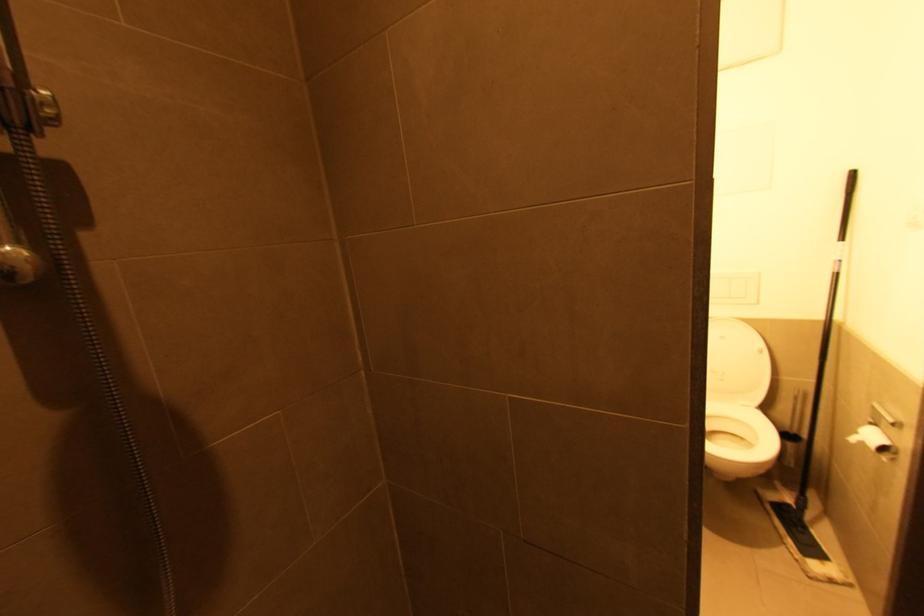
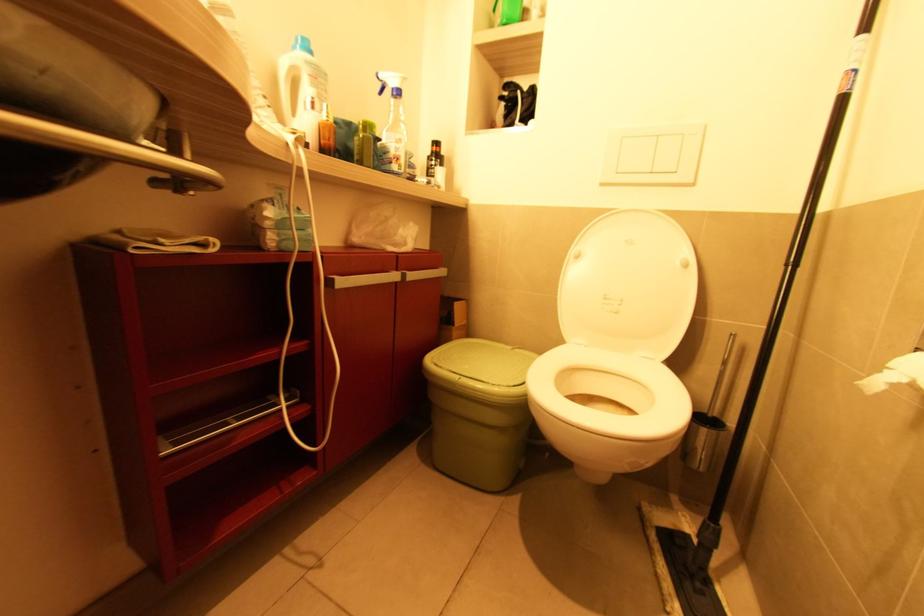
In a continuous first-person perspective shot, in which direction is the camera moving?

The cameraman moved toward right, forward.